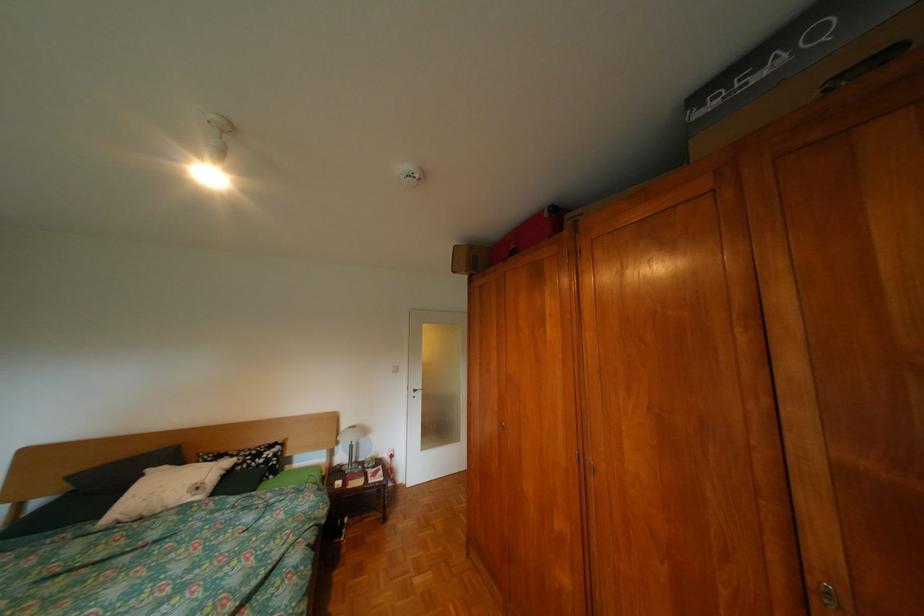
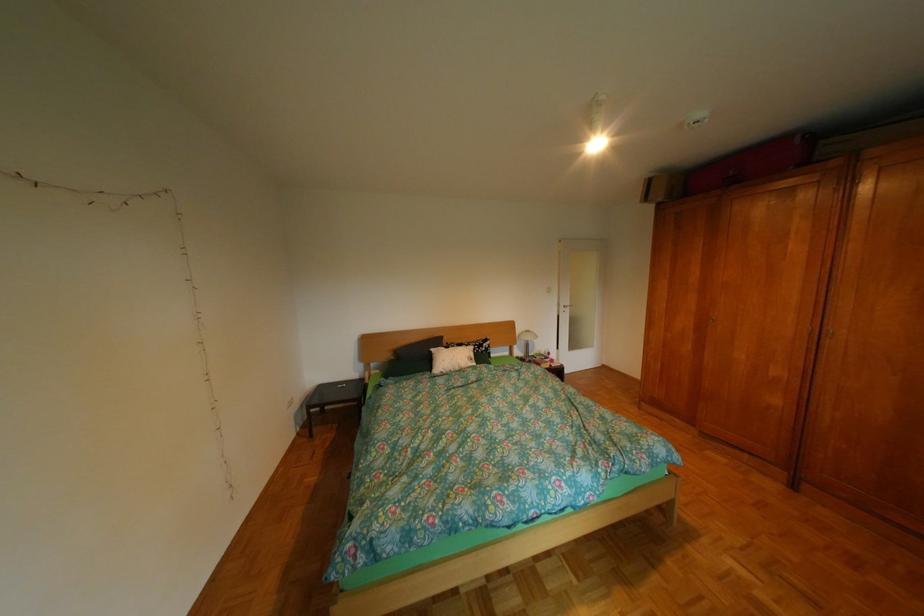
In the second image, find the point that corresponds to pixel 561 215 in the first image.

(812, 142)